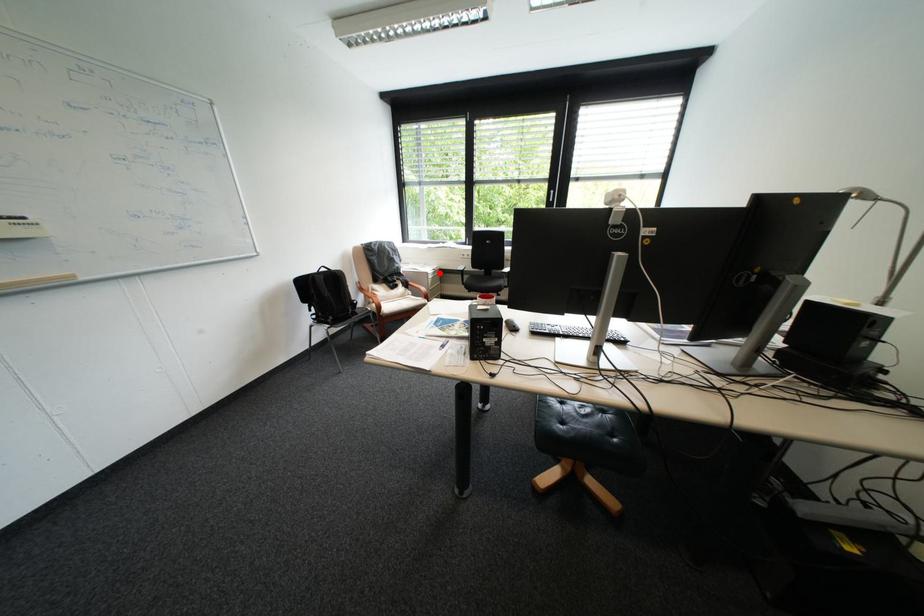
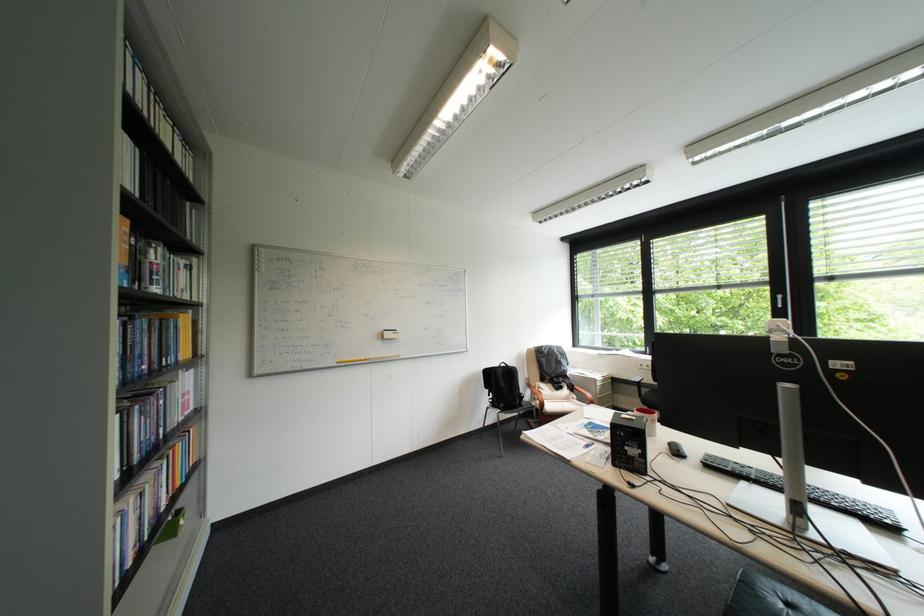
Question: I am providing you with two images of the same scene from different viewpoints. A red point is shown in image1. For the corresponding object point in image2, is it positioned nearer or farther from the camera?

Choices:
 (A) Nearer
 (B) Farther

Answer: (B)